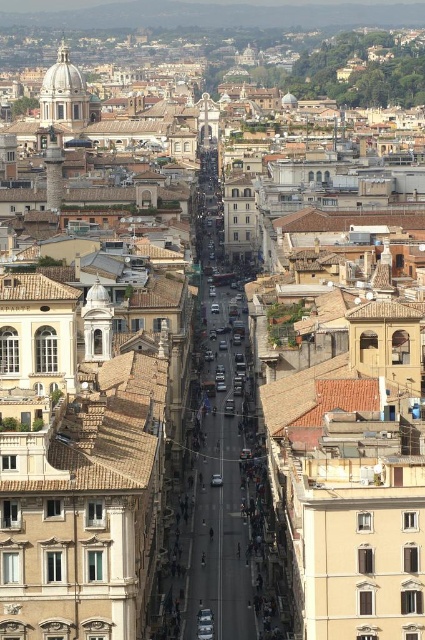
You are standing at the end of the street looking towards the buildings. You see a matte white dome at upper left and a silver metallic car at center. Which object is positioned further to the left from your viewpoint?

The matte white dome at upper left is positioned further to the left compared to the silver metallic car at center.

You are a photographer planning to capture a wide shot of the matte white dome at upper left and the silver metallic car at center. Based on the scene, which object should you prioritize framing first to ensure both are in the shot?

The matte white dome at upper left should be prioritized because it might be wider than the silver metallic car at center, so positioning the camera to accommodate its width first ensures both objects fit in the frame.